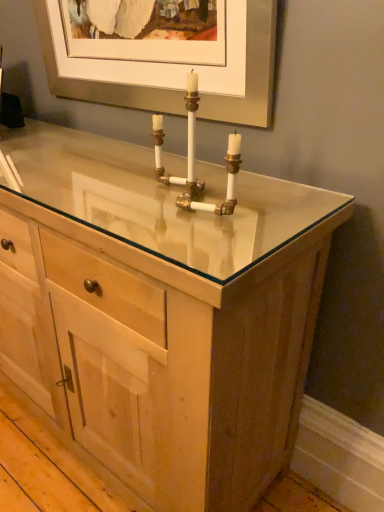
At what (x,y) coordinates should I click in order to perform the action: click on free space to the left of white brass pipe at center. Please return your answer as a coordinate pair (x, y). The image size is (384, 512). Looking at the image, I should click on (104, 201).